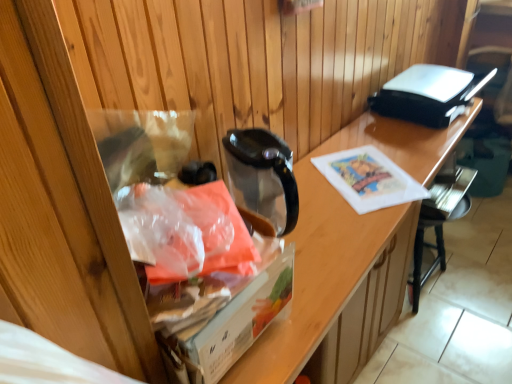
Locate an element on the screen. vacant space underneath translucent plastic bag at left (from a real-world perspective) is located at coordinates (186, 251).